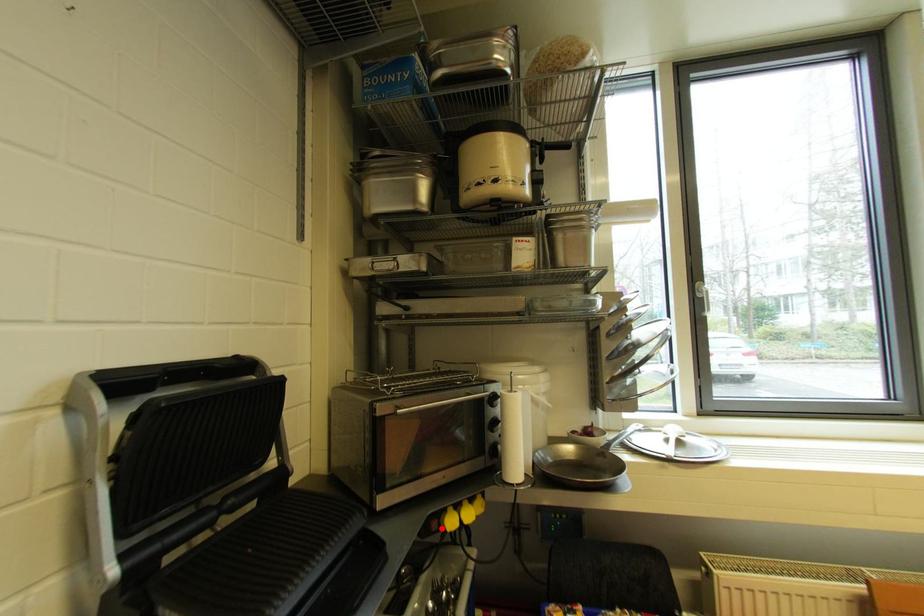
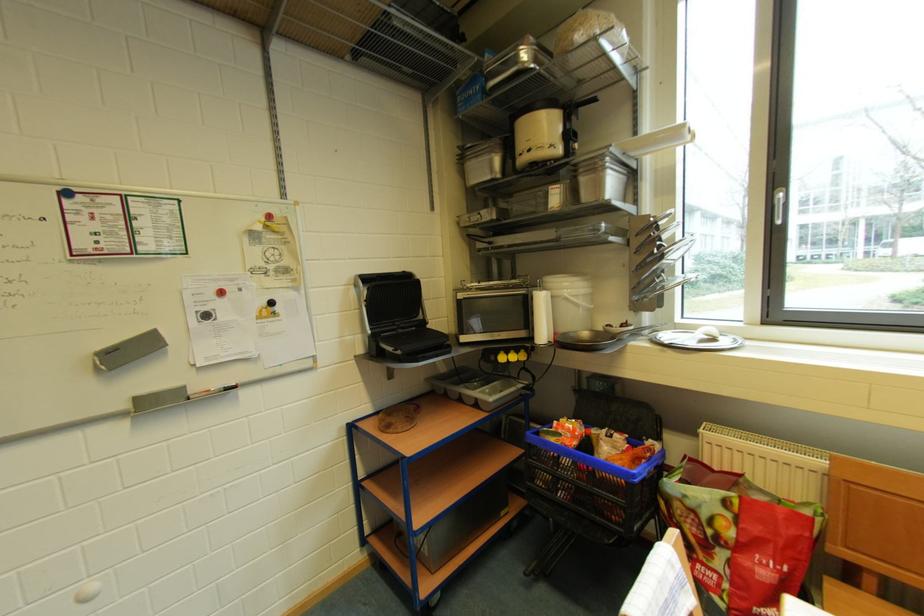
In the second image, find the point that corresponds to the highlighted location in the first image.

(500, 361)